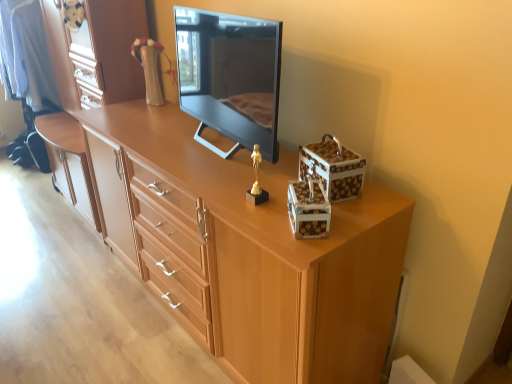
You are a GUI agent. You are given a task and a screenshot of the screen. Output one action in this format:
    pyautogui.click(x=<x>, y=<y>)
    Task: Click on the vacant area that is in front of light brown wood dresser at center
    The image size is (512, 384).
    Given the screenshot: What is the action you would take?
    pyautogui.click(x=58, y=271)